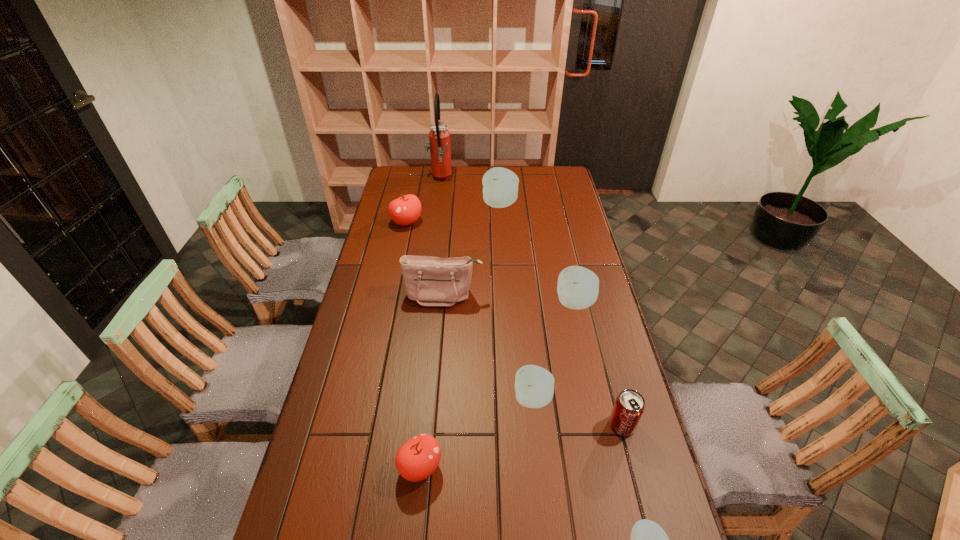
Where is `free space located on the left of the second nearest white apple`? Image resolution: width=960 pixels, height=540 pixels. free space located on the left of the second nearest white apple is located at coordinates (417, 399).

Find the location of a particular element. The width and height of the screenshot is (960, 540). free location located on the right of the smaller red apple is located at coordinates (552, 467).

Image resolution: width=960 pixels, height=540 pixels. In order to click on object situated at the far edge in this screenshot , I will do `click(439, 137)`.

Locate an element on the screen. object that is at the left edge is located at coordinates (405, 210).

Locate an element on the screen. This screenshot has height=540, width=960. apple at the right edge is located at coordinates (578, 287).

At what (x,y) coordinates should I click in order to perform the action: click on pop soda situated at the right edge. Please return your answer as a coordinate pair (x, y). The image size is (960, 540). Looking at the image, I should click on (629, 406).

Identify the location of vacant space at the far edge of the desktop. Image resolution: width=960 pixels, height=540 pixels. (506, 168).

The image size is (960, 540). Identify the location of free spot at the left edge of the desktop. (396, 247).

At what (x,y) coordinates should I click in order to perform the action: click on vacant area at the right edge. Please return your answer as a coordinate pair (x, y). Image resolution: width=960 pixels, height=540 pixels. Looking at the image, I should click on [x=574, y=192].

This screenshot has height=540, width=960. Find the location of `free space at the far left corner of the desktop`. free space at the far left corner of the desktop is located at coordinates (394, 180).